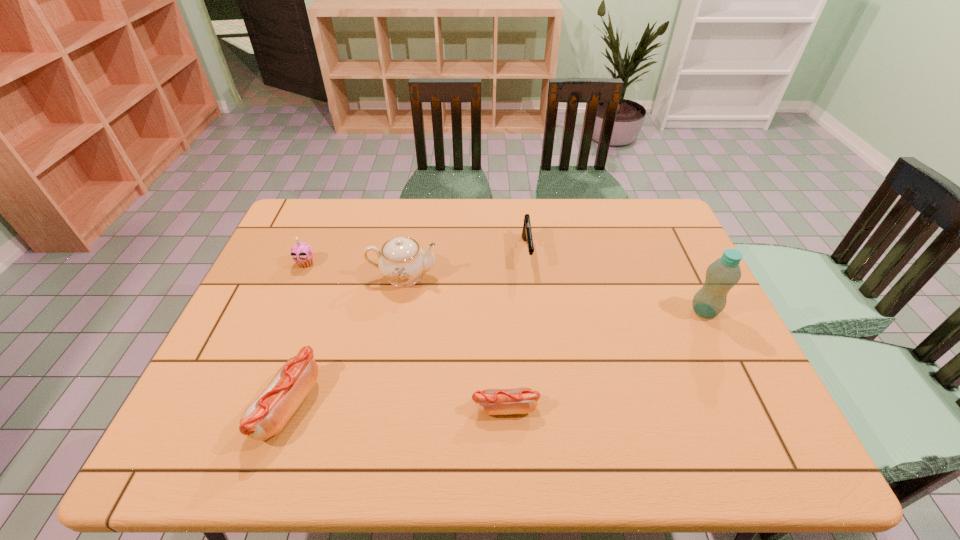
What are the coordinates of `the second object from left to right` in the screenshot? It's located at (267, 415).

At what (x,y) coordinates should I click in order to perform the action: click on the left sausage. Please return your answer as a coordinate pair (x, y). Looking at the image, I should click on (267, 415).

I want to click on the fourth object from left to right, so click(523, 400).

This screenshot has height=540, width=960. Identify the location of the right sausage. (523, 400).

You are a GUI agent. You are given a task and a screenshot of the screen. Output one action in this format:
    pyautogui.click(x=<x>, y=<y>)
    Task: Click on the leftmost object
    Image resolution: width=960 pixels, height=540 pixels.
    Given the screenshot: What is the action you would take?
    pyautogui.click(x=301, y=253)

Where is `the rightmost object`? Image resolution: width=960 pixels, height=540 pixels. the rightmost object is located at coordinates (723, 274).

Find the location of `the fourth farthest object`. the fourth farthest object is located at coordinates (723, 274).

Identify the location of gun. The width and height of the screenshot is (960, 540). (526, 232).

The height and width of the screenshot is (540, 960). I want to click on chinaware, so click(x=401, y=260).

Locate an element on the screen. the fourth object from right to left is located at coordinates (401, 260).